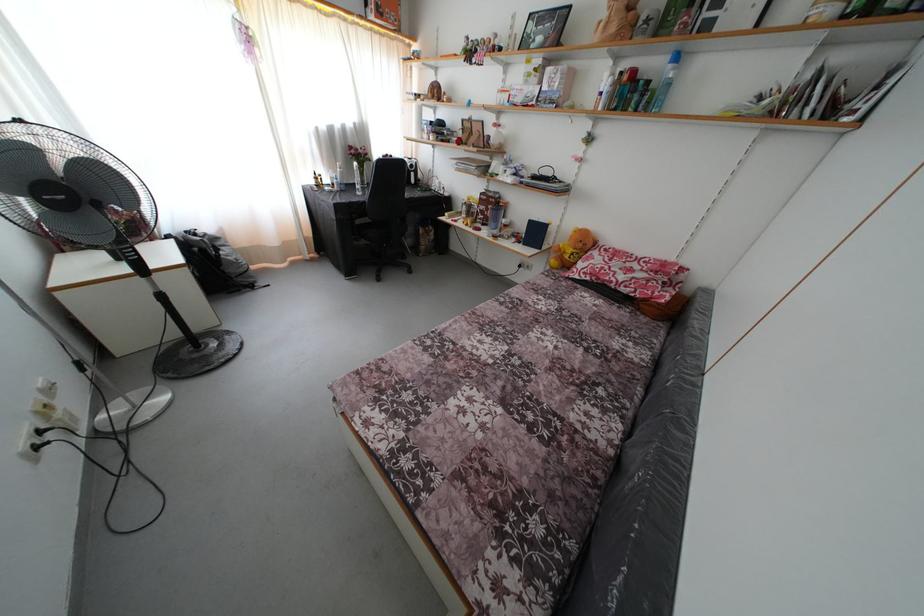
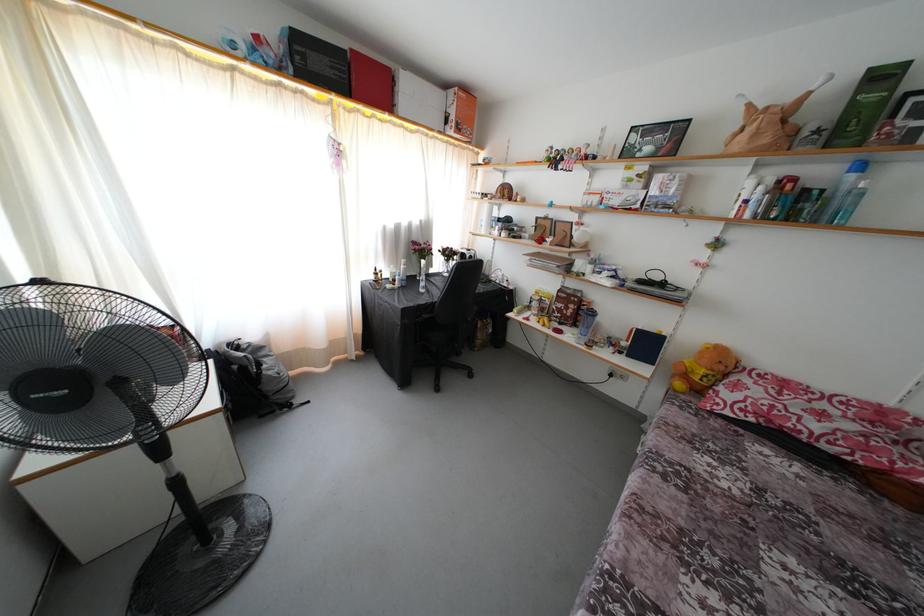
In a continuous first-person perspective shot, in which direction is the camera moving?

The movement direction of the cameraman is left, forward.